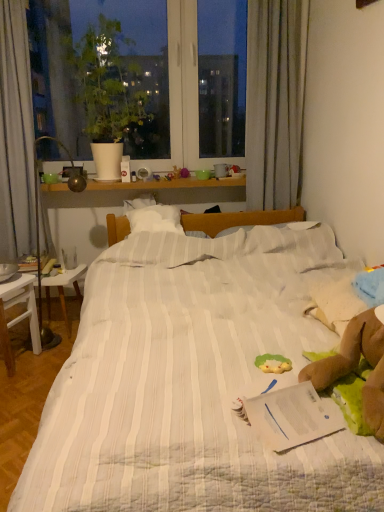
Question: In terms of height, does white paper at center look taller or shorter compared to white wooden table at lower left, which appears as the first table when viewed from the front?

Choices:
 (A) short
 (B) tall

Answer: (A)

Question: Based on their positions, is white paper at center located to the left or right of white wooden table at lower left, which is the 2th table from back to front?

Choices:
 (A) right
 (B) left

Answer: (A)

Question: Which of these objects is positioned farthest from the green plush toy at center?

Choices:
 (A) white paper at center
 (B) white striped fabric bed at center
 (C) white wooden table at left, the first table in the back-to-front sequence
 (D) green matte plant at upper left
 (E) white wooden table at lower left, which appears as the first table when viewed from the front

Answer: (D)

Question: Which of these objects is positioned closest to the white paper at center?

Choices:
 (A) green matte plant at upper left
 (B) white striped fabric bed at center
 (C) green plush toy at center
 (D) white wooden table at left, placed as the second table when sorted from front to back
 (E) white wooden table at lower left, which appears as the first table when viewed from the front

Answer: (C)